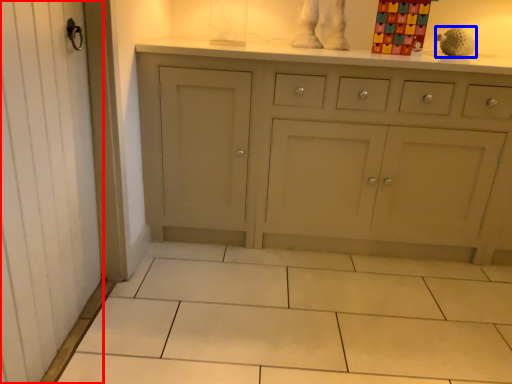
Question: Which object is closer to the camera taking this photo, screen door (highlighted by a red box) or toy (highlighted by a blue box)?

Choices:
 (A) screen door
 (B) toy

Answer: (A)